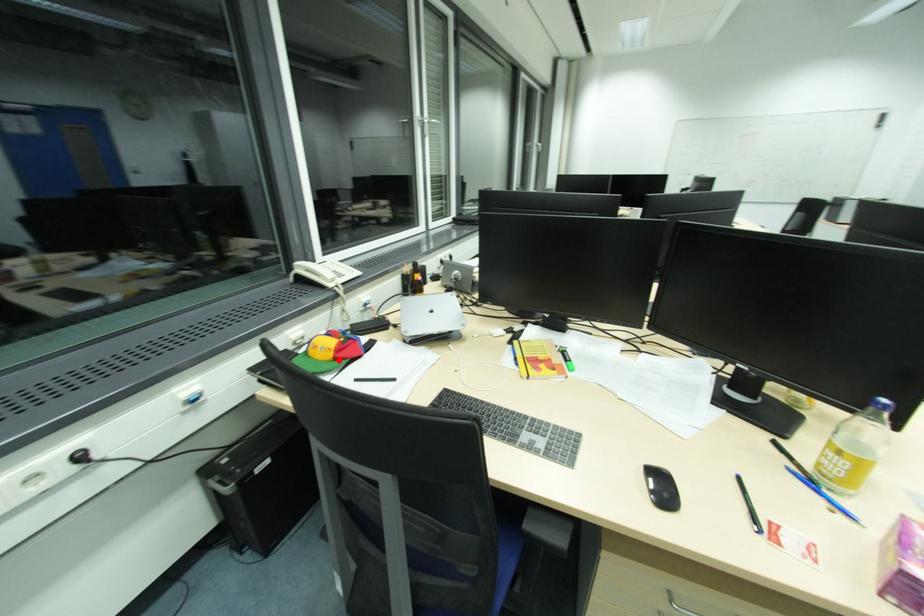
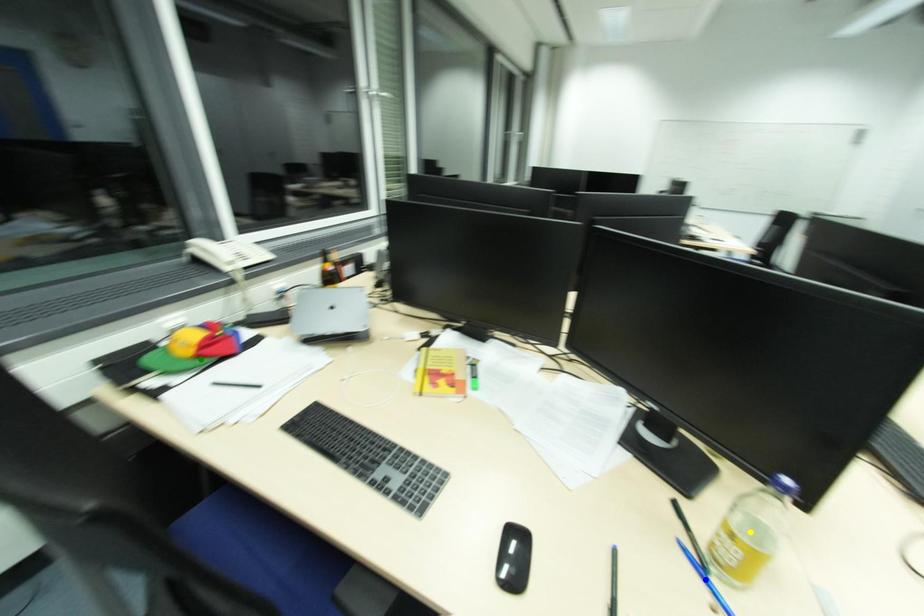
Question: I am providing you with two images of the same scene from different viewpoints. A red point is marked on the first image. You are given multiple points on the second image. Can you choose the point in image 2 that corresponds to the point in image 1?

Choices:
 (A) blue point
 (B) green point
 (C) yellow point

Answer: (B)